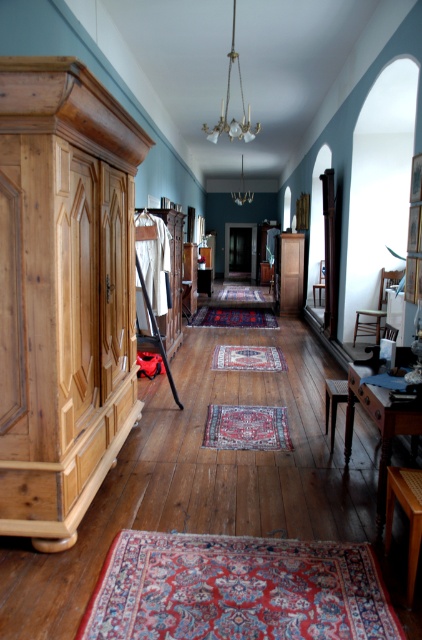
Question: Which object is positioned farthest from the wooden table at lower right?

Choices:
 (A) natural wood armoire at left
 (B) wooden chair at center

Answer: (A)

Question: Can you confirm if brass glass chandelier at upper center is bigger than wooden chair at right?

Choices:
 (A) no
 (B) yes

Answer: (A)

Question: Among these points, which one is nearest to the camera?

Choices:
 (A) (387, 472)
 (B) (97, 296)

Answer: (A)

Question: Is brass glass chandelier at upper center to the left of wooden chair at center from the viewer's perspective?

Choices:
 (A) no
 (B) yes

Answer: (B)

Question: Which object is farther from the camera taking this photo?

Choices:
 (A) natural wood armoire at left
 (B) wooden chair at center

Answer: (B)

Question: From the image, what is the correct spatial relationship of natural wood armoire at left in relation to brass glass chandelier at upper center?

Choices:
 (A) below
 (B) above

Answer: (A)